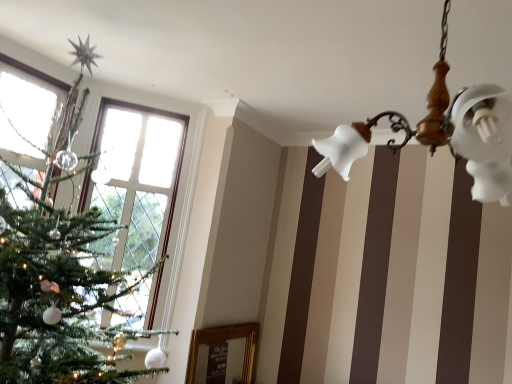
Question: Can you confirm if white glass chandelier at upper right is thinner than clear glass window at left?

Choices:
 (A) no
 (B) yes

Answer: (A)

Question: From the image's perspective, is white glass chandelier at upper right under clear glass window at left?

Choices:
 (A) no
 (B) yes

Answer: (A)

Question: Does white glass chandelier at upper right have a smaller size compared to clear glass window at left?

Choices:
 (A) no
 (B) yes

Answer: (A)

Question: Considering the relative positions of white glass chandelier at upper right and clear glass window at left in the image provided, is white glass chandelier at upper right to the right of clear glass window at left from the viewer's perspective?

Choices:
 (A) no
 (B) yes

Answer: (B)

Question: Can you confirm if white glass chandelier at upper right is bigger than clear glass window at left?

Choices:
 (A) yes
 (B) no

Answer: (A)

Question: Could you tell me if white glass chandelier at upper right is facing clear glass window at left?

Choices:
 (A) yes
 (B) no

Answer: (B)

Question: From a real-world perspective, is clear glass window at left under white glass chandelier at upper right?

Choices:
 (A) yes
 (B) no

Answer: (A)

Question: Is clear glass window at left not near white glass chandelier at upper right?

Choices:
 (A) yes
 (B) no

Answer: (A)

Question: Considering the relative sizes of clear glass window at left and white glass chandelier at upper right in the image provided, is clear glass window at left shorter than white glass chandelier at upper right?

Choices:
 (A) yes
 (B) no

Answer: (B)

Question: Is clear glass window at left not within white glass chandelier at upper right?

Choices:
 (A) yes
 (B) no

Answer: (A)

Question: From the image's perspective, does clear glass window at left appear higher than white glass chandelier at upper right?

Choices:
 (A) no
 (B) yes

Answer: (A)

Question: Is clear glass window at left oriented towards white glass chandelier at upper right?

Choices:
 (A) no
 (B) yes

Answer: (A)

Question: In terms of width, does clear glass window at left look wider or thinner when compared to white glass chandelier at upper right?

Choices:
 (A) thin
 (B) wide

Answer: (A)